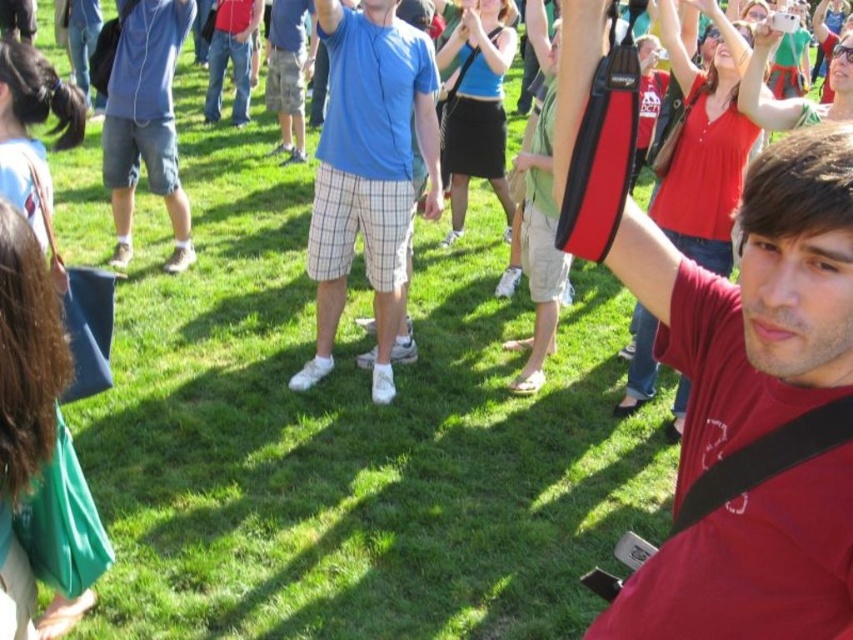
Question: Based on their relative distances, which object is farther from the denim shorts at left?

Choices:
 (A) blue cotton shirt at center
 (B) matte red shirt at center

Answer: (B)

Question: Is matte red shirt at center closer to camera compared to blue cotton shirt at center?

Choices:
 (A) yes
 (B) no

Answer: (A)

Question: Among these objects, which one is nearest to the camera?

Choices:
 (A) plaid shorts at center
 (B) denim shorts at left
 (C) matte red shirt at center

Answer: (C)

Question: From the image, what is the correct spatial relationship of denim shorts at left in relation to plaid shorts at center?

Choices:
 (A) above
 (B) below

Answer: (B)

Question: Does denim shorts at left have a smaller size compared to plaid shorts at center?

Choices:
 (A) yes
 (B) no

Answer: (A)

Question: Among these objects, which one is farthest from the camera?

Choices:
 (A) matte red shirt at center
 (B) blue cotton shirt at center

Answer: (B)